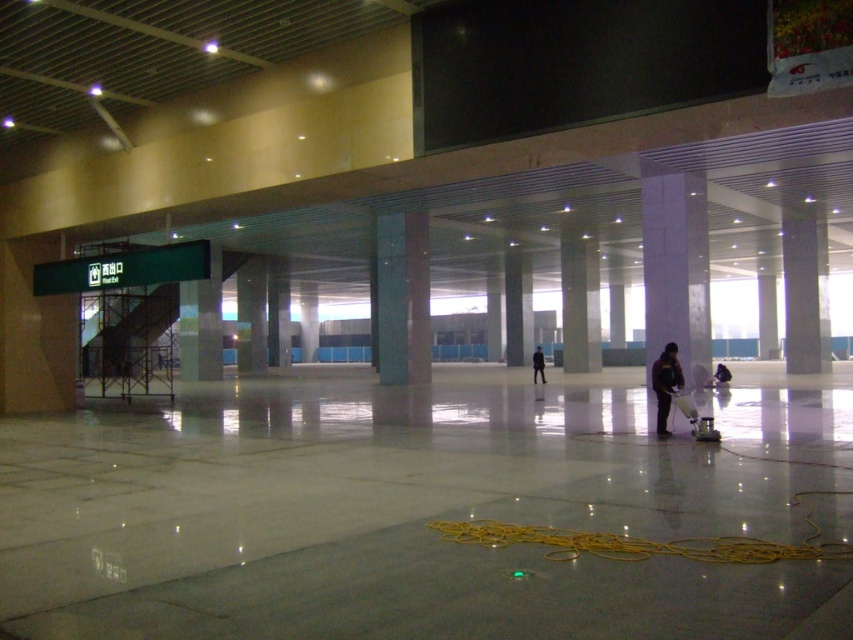
Question: Which point is farther to the camera?

Choices:
 (A) dark blue uniform at center
 (B) black matte jacket at center

Answer: (B)

Question: Is dark blue uniform at center closer to camera compared to black matte jacket at center?

Choices:
 (A) yes
 (B) no

Answer: (A)

Question: Is dark blue uniform at center smaller than black matte jacket at center?

Choices:
 (A) no
 (B) yes

Answer: (B)

Question: Which point is farther from the camera taking this photo?

Choices:
 (A) coord(663,432)
 (B) coord(538,358)

Answer: (B)

Question: Does dark blue uniform at center have a smaller size compared to black matte jacket at center?

Choices:
 (A) yes
 (B) no

Answer: (A)